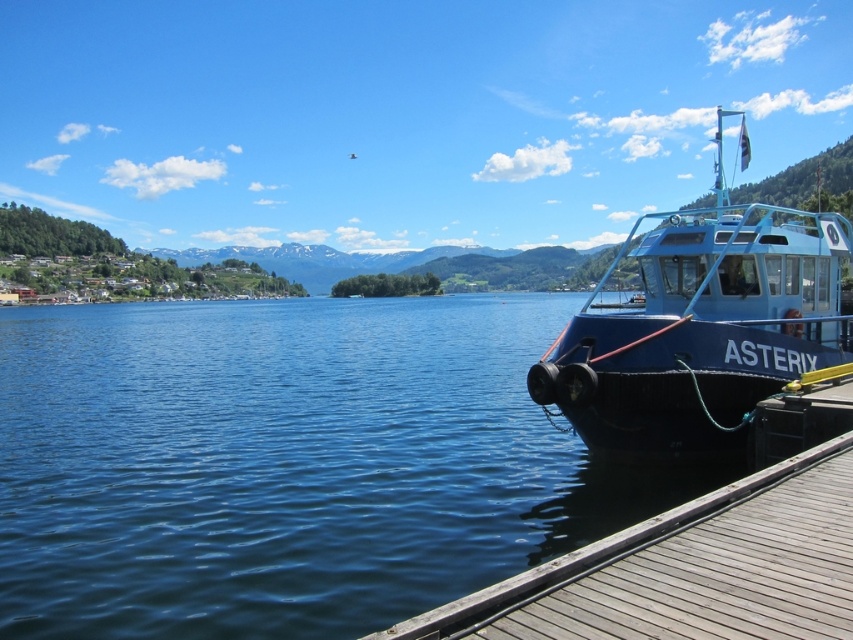
Question: Which point is closer to the camera?

Choices:
 (A) (648, 604)
 (B) (708, 236)

Answer: (A)

Question: Is blue matte boat at right closer to camera compared to wooden at right?

Choices:
 (A) no
 (B) yes

Answer: (A)

Question: Can you confirm if blue matte boat at right is wider than wooden at right?

Choices:
 (A) no
 (B) yes

Answer: (B)

Question: Can you confirm if blue matte boat at right is thinner than wooden at right?

Choices:
 (A) no
 (B) yes

Answer: (A)